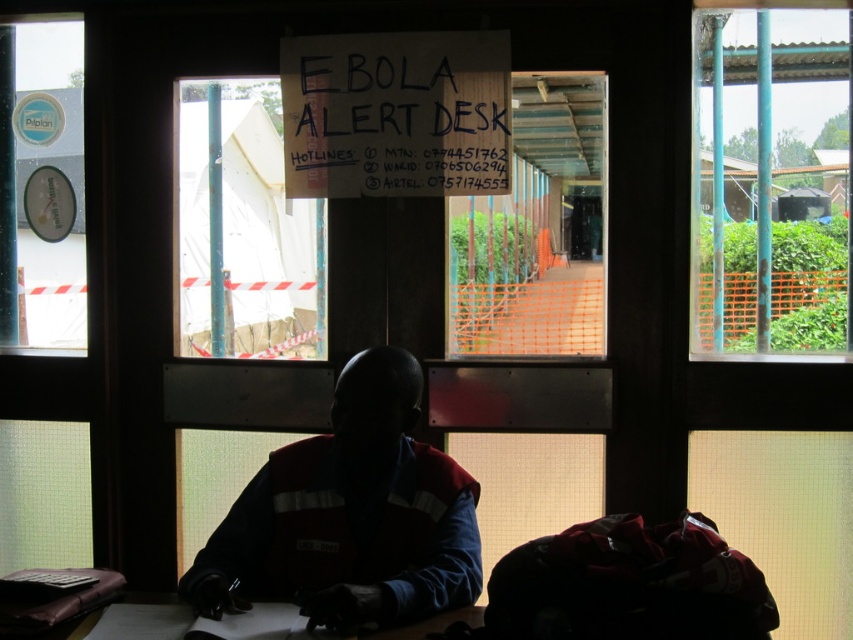
Question: Can you confirm if orange mesh fence at center is positioned below red fabric bag at lower right?

Choices:
 (A) yes
 (B) no

Answer: (B)

Question: Which is nearer to the dark blue fabric uniform at center?

Choices:
 (A) white plastic sign at upper center
 (B) transparent glass at left
 (C) red fabric bag at lower right
 (D) transparent glass window at center

Answer: (C)

Question: Does transparent glass at left have a smaller size compared to red matte safety vest at center?

Choices:
 (A) no
 (B) yes

Answer: (B)

Question: Which point is farther to the camera?

Choices:
 (A) (440, 188)
 (B) (258, 122)
 (C) (677, 608)
 (D) (463, 566)

Answer: (B)

Question: Does wooden signboard at center have a smaller size compared to orange mesh fence at center?

Choices:
 (A) no
 (B) yes

Answer: (B)

Question: Which object is closer to the camera taking this photo?

Choices:
 (A) transparent glass at left
 (B) transparent glass window at center

Answer: (B)